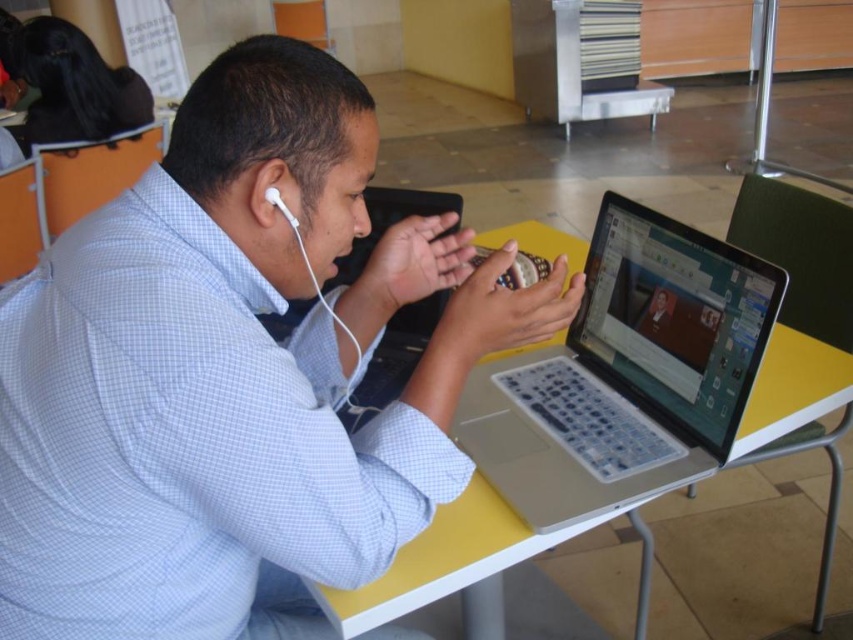
You are a person with a height of 1.7 meters. You are standing in front of the yellow plastic table at center and want to reach the laptop placed on it. Considering your height and the table distance, can you comfortably reach the items on the table?

The yellow plastic table at center is 1.69 meters away from you. Since your height is 1.7 meters, you can comfortably reach the items on the table as the distance is slightly less than your height.

You are a person who wants to place a new book on the yellow plastic table at center. The book is as wide as the white plastic earphone at left. Will the book fit on the table without hanging over the edge?

The yellow plastic table at center is wider than the white plastic earphone at left, so the book, which is as wide as the earphone, will fit on the table without hanging over the edge.

What is the 2D coordinate of the white checkered shirt at center?

The 2D coordinate of the white checkered shirt at center is at point (231, 372).